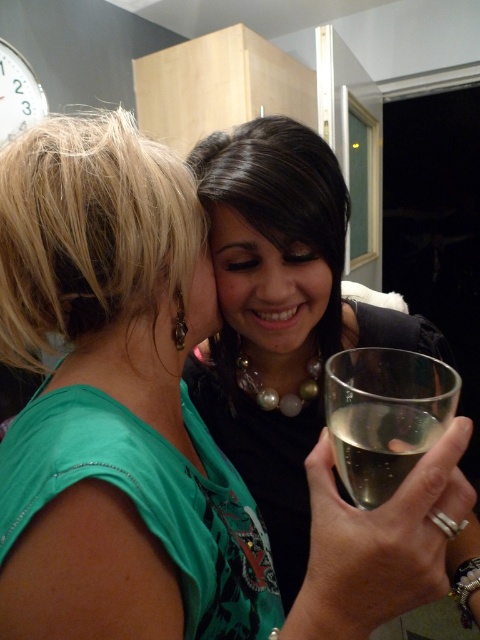
You are a photographer at a social event and need to capture a closeup of the clear glass wine glass at lower right. Based on its position, what coordinates should you focus on?

The clear glass wine glass at lower right is located at coordinates point (384, 416), so you should focus on those coordinates to capture the closeup.

Based on the photo, you are a photographer standing at the camera position. You want to take a photo of the scene but need to ensure that the point at coordinates point (404,362) is in focus. Given that your camera has a depth of field that can sharply focus objects within 40 centimeters from the camera, will this point be in focus?

The distance between point (404,362) and the camera is 42.02 centimeters, which is slightly beyond the camera lens depth of field range of 40 centimeters. Therefore, the point at point (404,362) will not be in focus.

You are a photographer trying to capture a closeup shot of the clear glass wine glass at lower right and the smooth skin at center. Which object should you focus on first to ensure it appears sharp in the photo?

The clear glass wine glass at lower right is closer to the viewer than the smooth skin at center, so you should focus on the clear glass wine glass at lower right first to ensure it appears sharp.